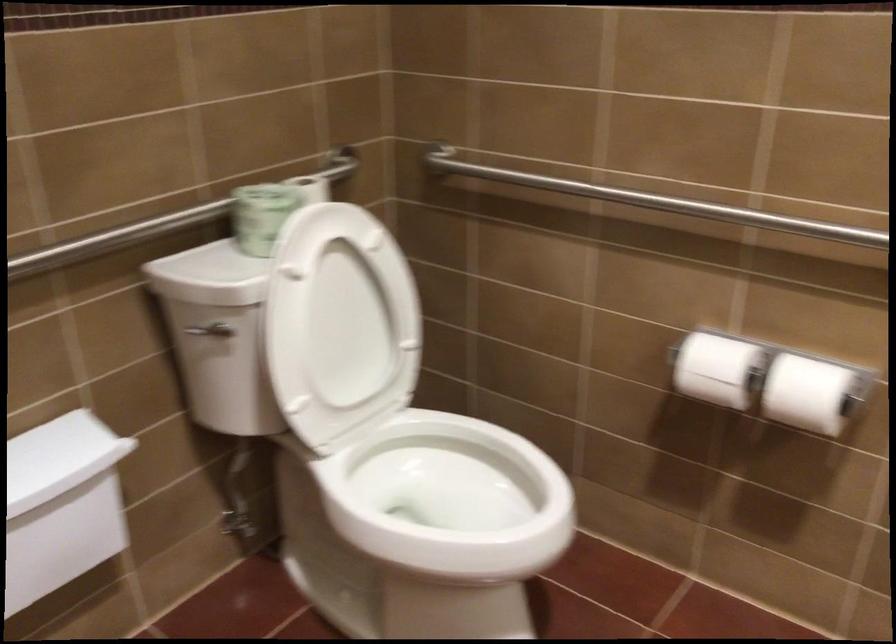
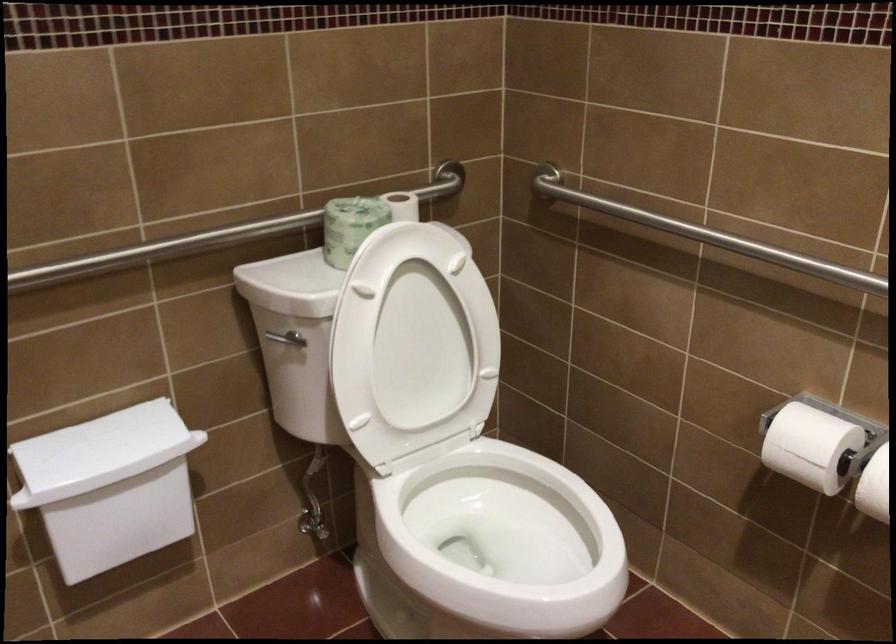
Locate, in the second image, the point that corresponds to (x=115, y=234) in the first image.

(204, 239)